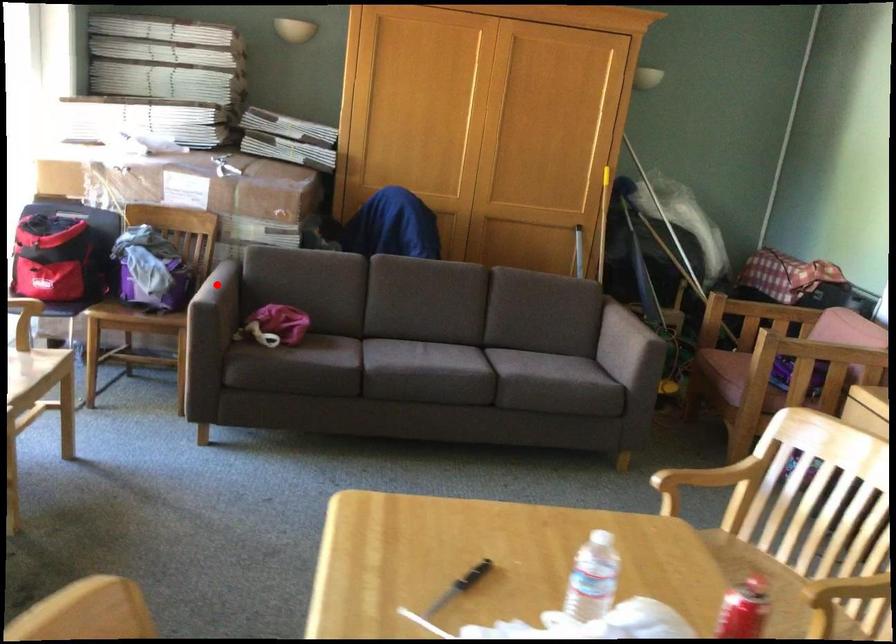
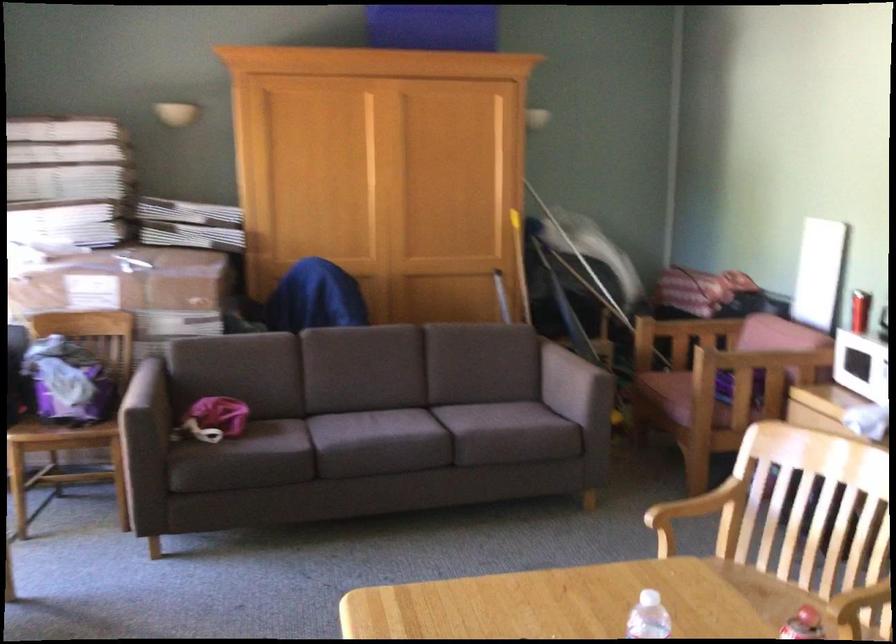
In the second image, find the point that corresponds to the highlighted location in the first image.

(144, 386)